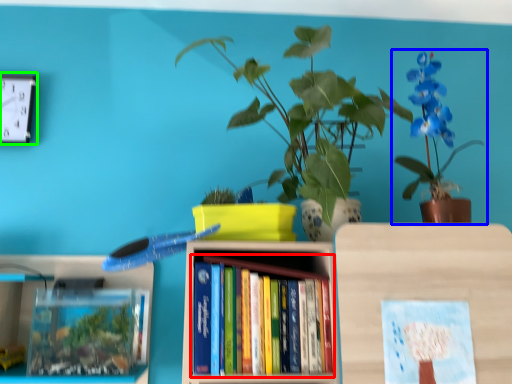
Question: Which is farther away from book (highlighted by a red box)? houseplant (highlighted by a blue box) or clock (highlighted by a green box)?

Choices:
 (A) houseplant
 (B) clock

Answer: (B)